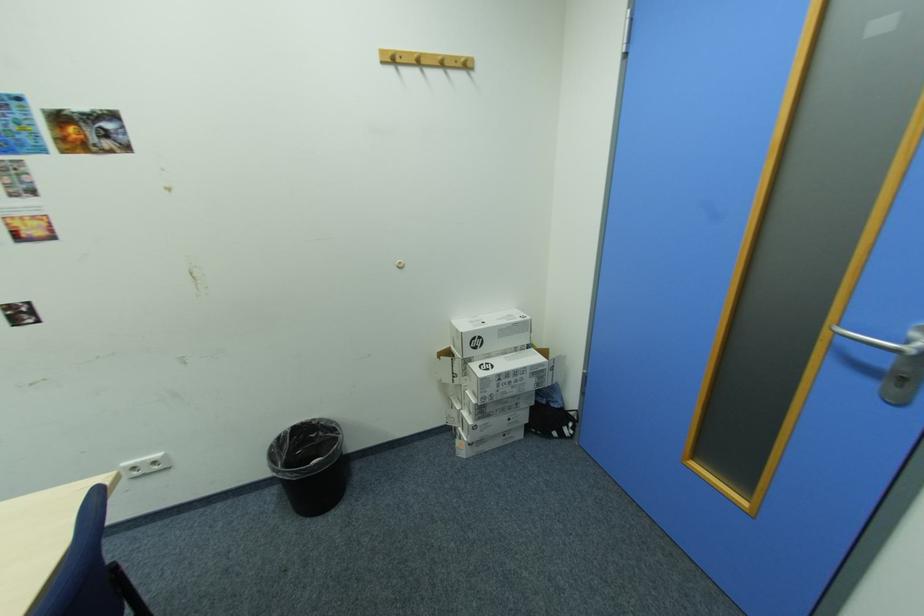
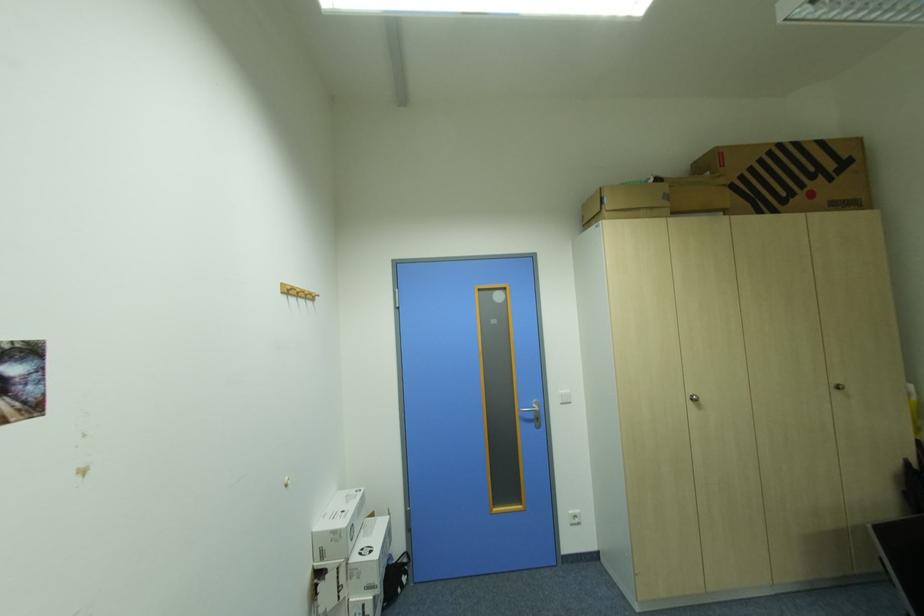
Locate, in the second image, the point that corresponds to (x=387, y=53) in the first image.

(293, 284)